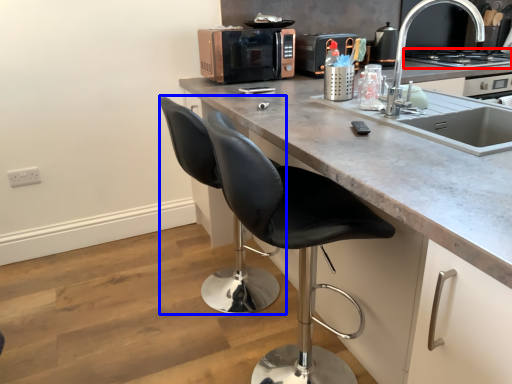
Question: Which of the following is the closest to the observer, home appliance (highlighted by a red box) or swivel chair (highlighted by a blue box)?

Choices:
 (A) home appliance
 (B) swivel chair

Answer: (B)